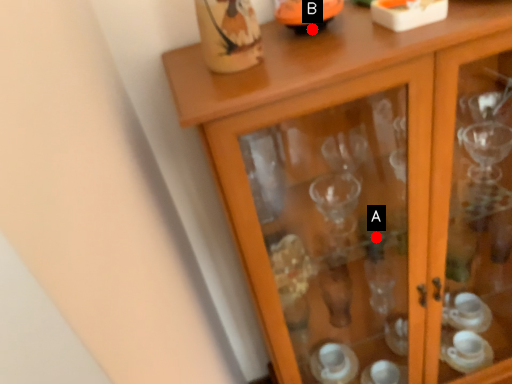
Question: Two points are circled on the image, labeled by A and B beside each circle. Which point appears farthest from the camera in this image?

Choices:
 (A) A is further
 (B) B is further

Answer: (A)